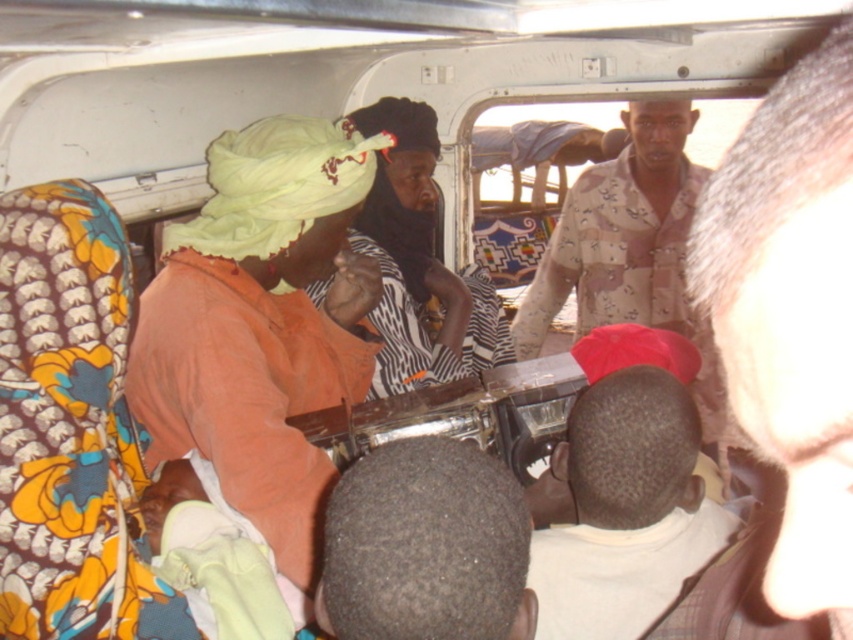
Question: Among these points, which one is farthest from the camera?

Choices:
 (A) (392, 516)
 (B) (608, 428)
 (C) (656, 276)
 (D) (764, 584)

Answer: (C)

Question: Can you confirm if matte orange shirt at center is positioned above camouflage shirt at center?

Choices:
 (A) no
 (B) yes

Answer: (A)

Question: Does dark brown leather hat at upper right have a larger size compared to zebra-patterned fabric at center?

Choices:
 (A) yes
 (B) no

Answer: (B)

Question: Which object is closer to the camera taking this photo?

Choices:
 (A) camouflage shirt at center
 (B) zebra-patterned fabric at center

Answer: (B)

Question: Which point is farther to the camera?

Choices:
 (A) camouflage shirt at center
 (B) dark hair at center
 (C) white matte shirt at center
 (D) matte orange shirt at center

Answer: (A)

Question: Is matte orange shirt at center below dark hair at center?

Choices:
 (A) no
 (B) yes

Answer: (A)